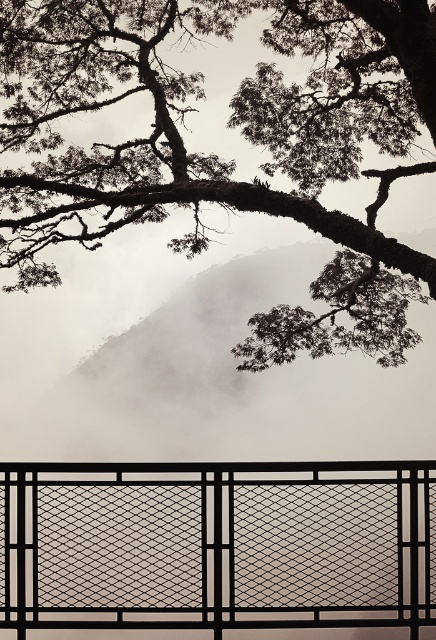
Question: Can you confirm if dark bark tree at upper center is positioned below black mesh fence at lower center?

Choices:
 (A) yes
 (B) no

Answer: (B)

Question: Does dark bark tree at upper center come in front of black mesh fence at lower center?

Choices:
 (A) yes
 (B) no

Answer: (B)

Question: Observing the image, what is the correct spatial positioning of dark bark tree at upper center in reference to black mesh fence at lower center?

Choices:
 (A) below
 (B) above

Answer: (B)

Question: Which point appears closest to the camera in this image?

Choices:
 (A) (418, 131)
 (B) (126, 536)

Answer: (B)